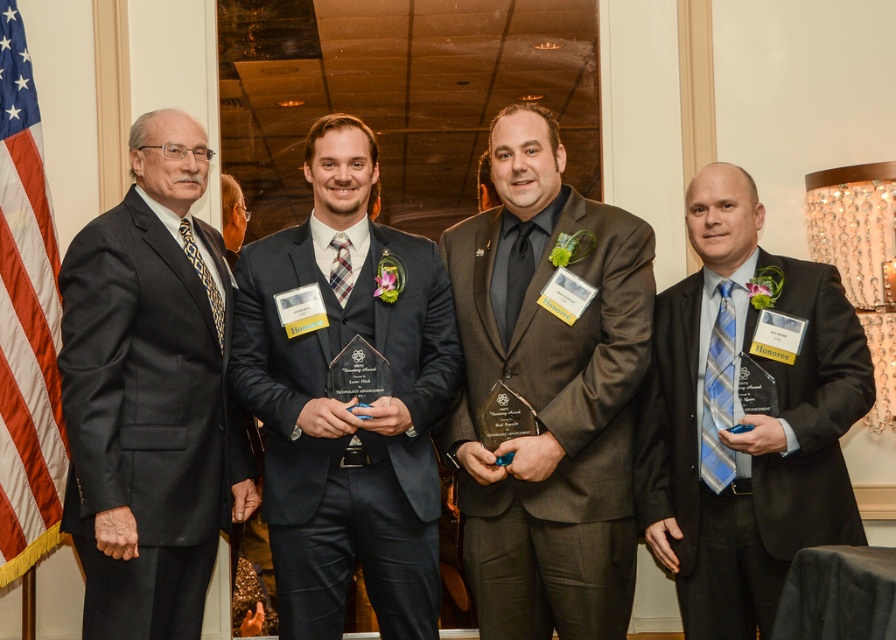
Between brown textured suit at center and matte black suit at center, which one appears on the right side from the viewer's perspective?

Positioned to the right is brown textured suit at center.

This screenshot has width=896, height=640. What are the coordinates of `brown textured suit at center` in the screenshot? It's located at (548, 397).

The width and height of the screenshot is (896, 640). Find the location of `brown textured suit at center`. brown textured suit at center is located at coordinates (548, 397).

Who is shorter, matte black suit at center or matte black suit at right?

matte black suit at right is shorter.

From the picture: Between matte black suit at center and matte black suit at right, which one has more height?

With more height is matte black suit at center.

Identify the location of matte black suit at center. This screenshot has width=896, height=640. (347, 403).

Identify the location of matte black suit at center. (347, 403).

Between matte black suit at center and leopard print tie at left, which one appears on the right side from the viewer's perspective?

From the viewer's perspective, matte black suit at center appears more on the right side.

Describe the element at coordinates (347, 403) in the screenshot. I see `matte black suit at center` at that location.

Does point (302, 388) come behind point (188, 228)?

No, (302, 388) is closer to viewer.

Image resolution: width=896 pixels, height=640 pixels. I want to click on matte black suit at center, so click(347, 403).